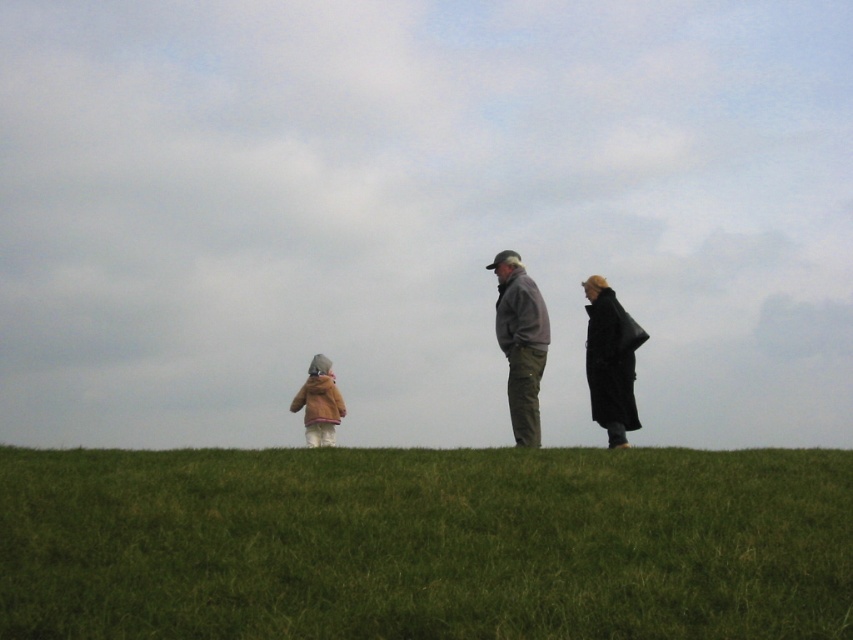
Which is below, green grassy hill at lower center or light brown fuzzy coat at lower left?

light brown fuzzy coat at lower left is lower down.

Does green grassy hill at lower center have a lesser width compared to light brown fuzzy coat at lower left?

Incorrect, green grassy hill at lower center's width is not less than light brown fuzzy coat at lower left's.

Between point (229, 625) and point (323, 416), which one is positioned behind?

Point (323, 416)

You are a GUI agent. You are given a task and a screenshot of the screen. Output one action in this format:
    pyautogui.click(x=<x>, y=<y>)
    Task: Click on the green grassy hill at lower center
    This screenshot has height=640, width=853.
    Given the screenshot: What is the action you would take?
    pyautogui.click(x=425, y=544)

Who is more forward, (495,484) or (624,326)?

Point (495,484) is in front.

Which of these two, green grassy hill at lower center or black leather coat at right, stands shorter?

green grassy hill at lower center

Between point (436, 515) and point (596, 296), which one is positioned behind?

The point (596, 296) is more distant.

Find the location of a particular element. The width and height of the screenshot is (853, 640). green grassy hill at lower center is located at coordinates (425, 544).

Can you confirm if green grassy hill at lower center is positioned below matte gray jacket at center?

Yes.

Is green grassy hill at lower center further to the viewer compared to matte gray jacket at center?

That is False.

Where is `green grassy hill at lower center`? This screenshot has width=853, height=640. green grassy hill at lower center is located at coordinates (425, 544).